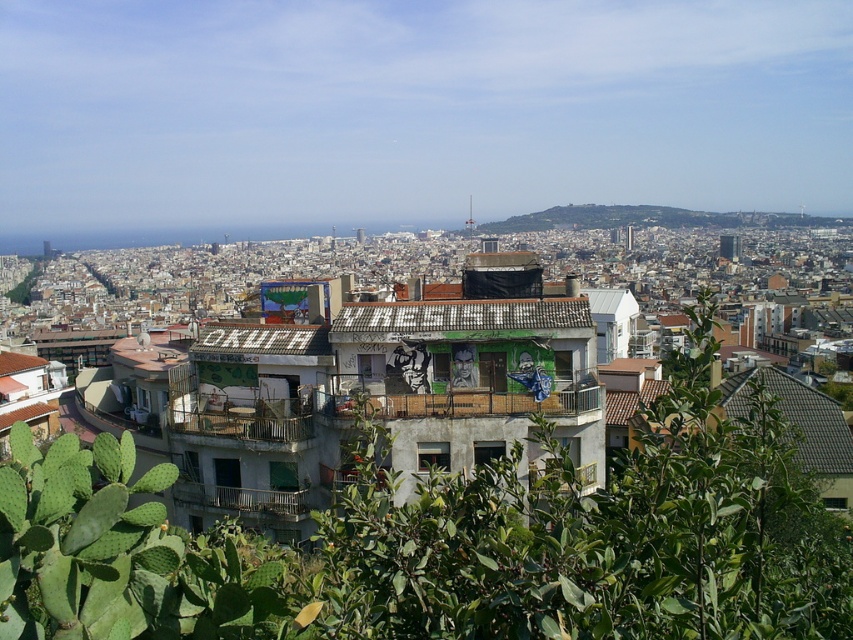
Which of these two, green leafy plant at center or green grassy hillside at upper center, stands shorter?

green leafy plant at center is shorter.

Is green leafy plant at center smaller than green grassy hillside at upper center?

Correct, green leafy plant at center occupies less space than green grassy hillside at upper center.

Who is more forward, (357,554) or (689,220)?

Point (357,554) is more forward.

At what (x,y) coordinates should I click in order to perform the action: click on green leafy plant at center. Please return your answer as a coordinate pair (x, y). This screenshot has width=853, height=640. Looking at the image, I should click on (457, 541).